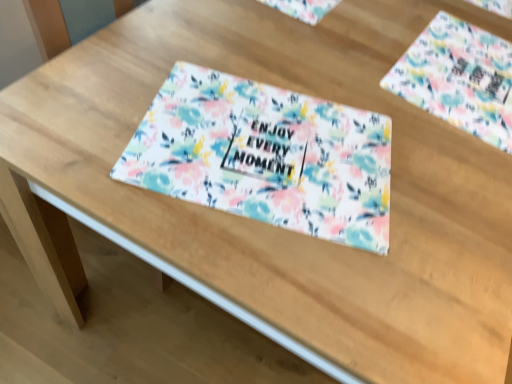
This screenshot has width=512, height=384. I want to click on vacant space underneath floral fabric placemat at center (from a real-world perspective), so click(271, 147).